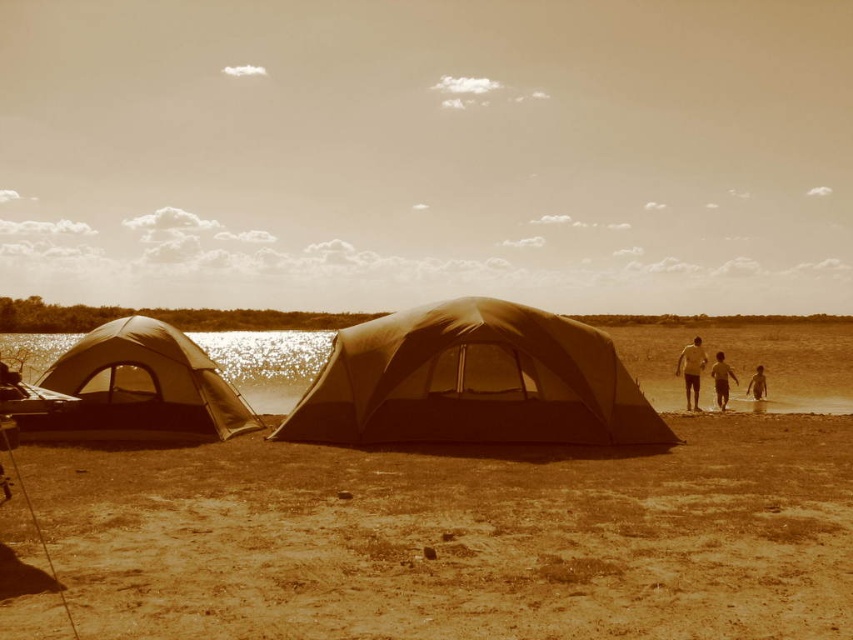
Is point (485, 419) more distant than point (694, 404)?

No, (485, 419) is closer to viewer.

Measure the distance between matte black tent at center and camera.

matte black tent at center is 34.30 feet away from camera.

Who is more forward, (x=378, y=394) or (x=685, y=378)?

Point (x=378, y=394) is more forward.

The height and width of the screenshot is (640, 853). Identify the location of matte black tent at center. (473, 381).

Is translucent water at center bigger than tan skin person at right?

Correct, translucent water at center is larger in size than tan skin person at right.

Can you confirm if translucent water at center is positioned to the right of tan skin person at right?

No, translucent water at center is not to the right of tan skin person at right.

Locate an element on the screen. The image size is (853, 640). translucent water at center is located at coordinates (747, 362).

Is point (175, 609) farther from viewer compared to point (62, 384)?

No.

Can you confirm if dull brown dirt at center is positioned to the left of matte gray tent at left?

In fact, dull brown dirt at center is to the right of matte gray tent at left.

Consider the image. Who is more distant from viewer, (x=256, y=513) or (x=70, y=396)?

Point (x=70, y=396)

Locate an element on the screen. dull brown dirt at center is located at coordinates (459, 540).